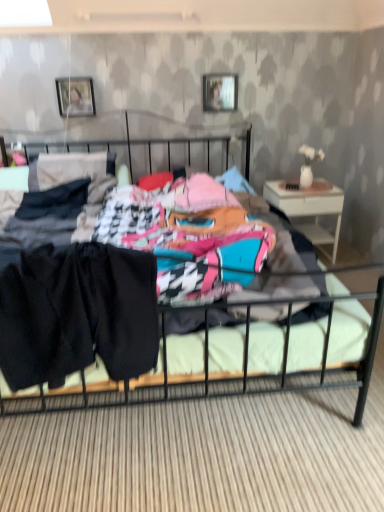
Where is `free point to the right of white wood nightstand at right`? This screenshot has height=512, width=384. free point to the right of white wood nightstand at right is located at coordinates (353, 260).